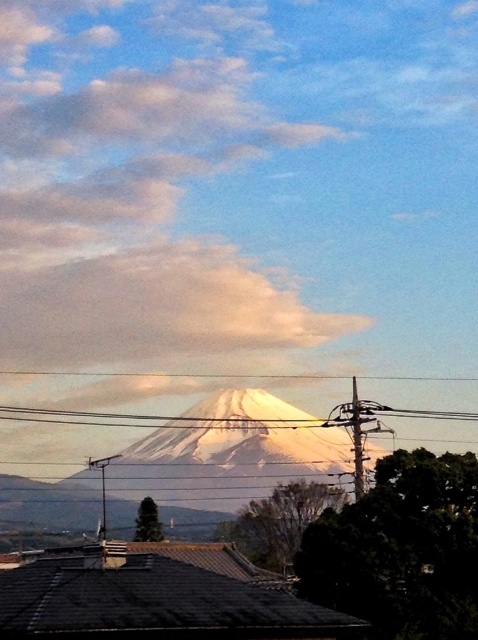
Question: Is white fluffy cloud at upper center wider than white snow-covered mountain at center?

Choices:
 (A) yes
 (B) no

Answer: (A)

Question: Is white fluffy cloud at upper center thinner than white snow-covered mountain at center?

Choices:
 (A) no
 (B) yes

Answer: (A)

Question: Does white fluffy cloud at upper center have a greater width compared to white snow-covered mountain at center?

Choices:
 (A) no
 (B) yes

Answer: (B)

Question: Which of the following is the farthest from the observer?

Choices:
 (A) (108, 314)
 (B) (294, 449)

Answer: (A)

Question: Among these objects, which one is farthest from the camera?

Choices:
 (A) white snow-covered mountain at center
 (B) white fluffy cloud at upper center

Answer: (B)